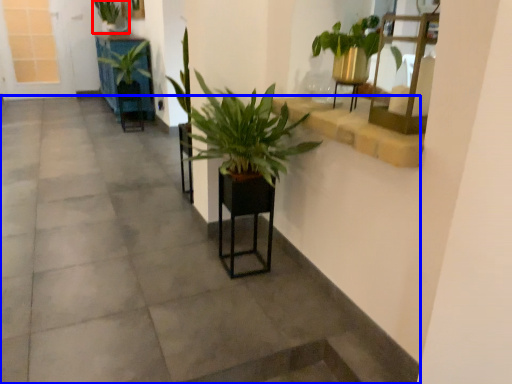
Question: Which of the following is the closest to the observer, houseplant (highlighted by a red box) or concrete (highlighted by a blue box)?

Choices:
 (A) houseplant
 (B) concrete

Answer: (B)